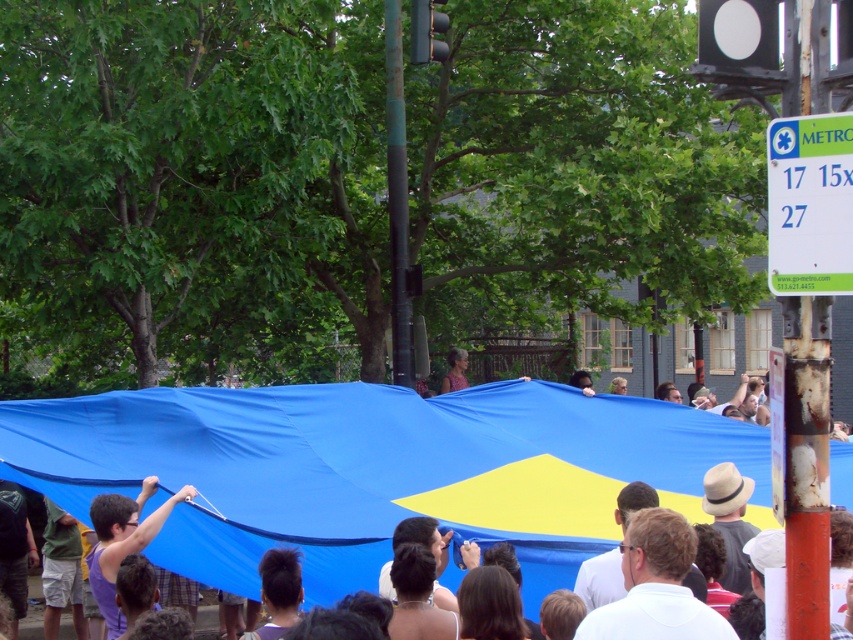
You are standing at the point with coordinates point (465,381) and want to walk to the point with coordinates point (128,440). Based on the scene description, will you have to walk towards the stage or away from it?

Point (128,440) is in front of point (465,381). Since the stage is covered by the large blue tarp with a yellow diamond shape in the center, and the crowd is gathered around it, walking towards point (128,440) would mean moving closer to the stage.

You are a photographer standing in the crowd and want to take a photo of the green plastic sign at upper right without the blue tarpaulin at center blocking it. What should you do?

Move closer to the green plastic sign at upper right so that the blue tarpaulin at center is no longer in front of it, since the blue tarpaulin at center is closer to you than the green plastic sign at upper right.